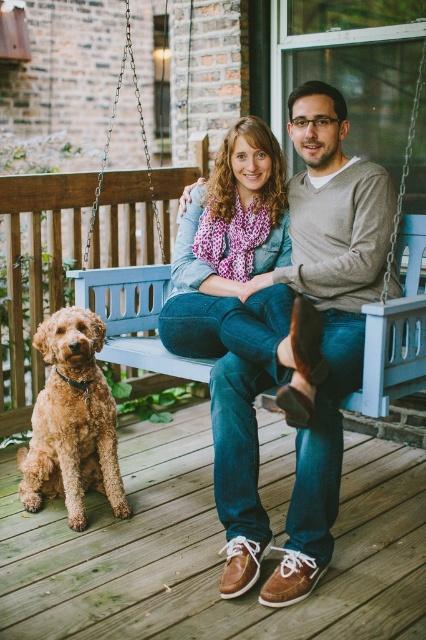
Does point (229, 476) come closer to viewer compared to point (83, 432)?

That is True.

Can you confirm if brown suede shoes at center is taller than golden fur dog at lower left?

Indeed, brown suede shoes at center has a greater height compared to golden fur dog at lower left.

Which is in front, point (258, 369) or point (60, 368)?

Point (258, 369) is in front.

In order to click on brown suede shoes at center in this screenshot , I will do `click(285, 337)`.

Does brown leather shoes at lower center appear over golden fur dog at lower left?

Actually, brown leather shoes at lower center is below golden fur dog at lower left.

Does brown leather shoes at lower center lie behind golden fur dog at lower left?

No, brown leather shoes at lower center is in front of golden fur dog at lower left.

Does point (117, 609) lie in front of point (37, 445)?

Yes, it is in front of point (37, 445).

Find the location of `brown leather shoes at lower center`. brown leather shoes at lower center is located at coordinates (209, 550).

Is golden fur dog at lower left positioned at the back of blue wooden swing at center?

No.

Between golden fur dog at lower left and blue wooden swing at center, which one appears on the right side from the viewer's perspective?

From the viewer's perspective, blue wooden swing at center appears more on the right side.

Does point (60, 467) lie behind point (356, 406)?

Yes, it is behind point (356, 406).

Find the location of a particular element. This screenshot has height=640, width=426. golden fur dog at lower left is located at coordinates (71, 420).